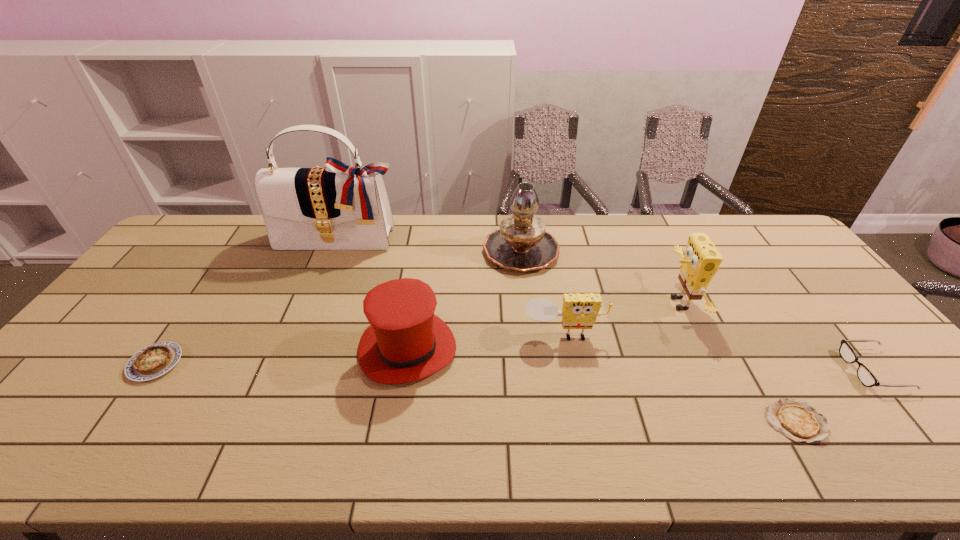
Identify the location of the farther quiche. This screenshot has width=960, height=540. (156, 359).

The width and height of the screenshot is (960, 540). I want to click on the nearest object, so click(x=795, y=419).

Find the location of `the nearer quiche`. the nearer quiche is located at coordinates (795, 419).

At what (x,y) coordinates should I click in order to perform the action: click on free space located 0.310m on the front-facing side of the satchel. Please return your answer as a coordinate pair (x, y). This screenshot has height=540, width=960. Looking at the image, I should click on click(307, 320).

The height and width of the screenshot is (540, 960). In order to click on vacant point located on the front of the oil lamp in this screenshot , I will do `click(526, 298)`.

Identify the location of vacant space situated on the face of the sixth object from left to right. (634, 303).

Find the location of `vacant area situated on the face of the sixth object from left to right`. vacant area situated on the face of the sixth object from left to right is located at coordinates click(x=559, y=303).

Find the location of a particular element. The image size is (960, 540). free point located on the face of the sixth object from left to right is located at coordinates (620, 303).

Where is `vacant space located 0.070m on the front of the fourth tallest object`? This screenshot has height=540, width=960. vacant space located 0.070m on the front of the fourth tallest object is located at coordinates (397, 414).

This screenshot has height=540, width=960. Identify the location of vacant space located on the front-facing side of the left sponge. (581, 426).